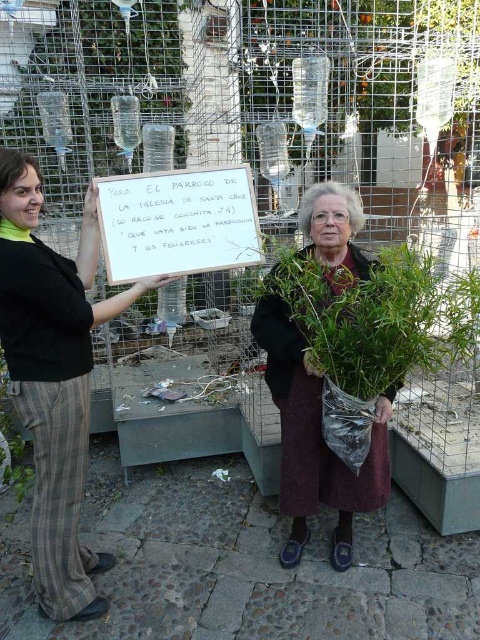
Can you confirm if green leafy plant at center is positioned below maroon woolen sweater at center?

Incorrect, green leafy plant at center is not positioned below maroon woolen sweater at center.

Who is taller, green leafy plant at center or maroon woolen sweater at center?

maroon woolen sweater at center

Is point (446, 292) positioned behind point (320, 388)?

No, it is in front of (320, 388).

At what (x,y) coordinates should I click in order to perform the action: click on green leafy plant at center. Please return your answer as a coordinate pair (x, y). Looking at the image, I should click on (363, 320).

Does black fabric pants at left have a lesser width compared to green leafy plant at center?

Correct, black fabric pants at left's width is less than green leafy plant at center's.

How far apart are black fabric pants at left and green leafy plant at center?

They are 33.53 inches apart.

Who is more forward, (x=62, y=451) or (x=289, y=378)?

Positioned in front is point (x=62, y=451).

In order to click on black fabric pants at left in this screenshot , I will do `click(54, 378)`.

Does point (37, 276) come closer to viewer compared to point (183, 228)?

Yes, point (37, 276) is in front of point (183, 228).

Is black fabric pants at left smaller than white paper sign at center?

Incorrect, black fabric pants at left is not smaller in size than white paper sign at center.

What do you see at coordinates (54, 378) in the screenshot?
I see `black fabric pants at left` at bounding box center [54, 378].

Find the location of a particular element. The image size is (480, 640). black fabric pants at left is located at coordinates (54, 378).